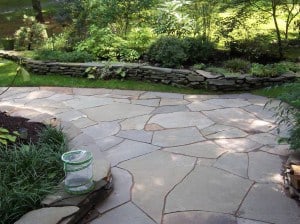
Identify the location of clear container. (76, 177).